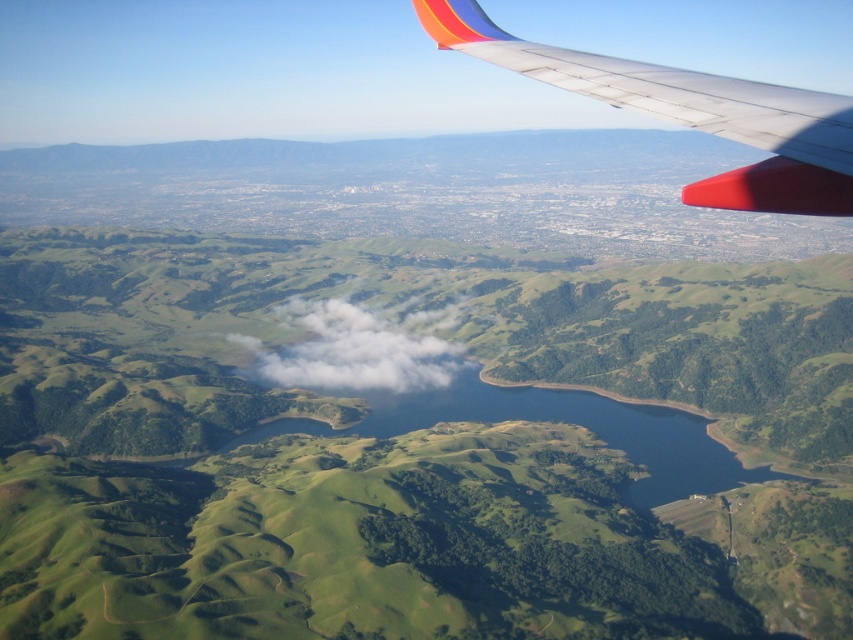
Looking at this image, who is lower down, metallic silver wing at upper right or white fluffy cloud at center?

white fluffy cloud at center is lower down.

Is metallic silver wing at upper right taller than white fluffy cloud at center?

In fact, metallic silver wing at upper right may be shorter than white fluffy cloud at center.

Is point (457, 28) farther from camera compared to point (410, 337)?

No, (457, 28) is closer to viewer.

Locate an element on the screen. metallic silver wing at upper right is located at coordinates (688, 113).

Does green grassy hills at center appear under metallic silver wing at upper right?

Yes, green grassy hills at center is below metallic silver wing at upper right.

Who is higher up, green grassy hills at center or metallic silver wing at upper right?

metallic silver wing at upper right is higher up.

The width and height of the screenshot is (853, 640). What are the coordinates of `green grassy hills at center` in the screenshot? It's located at (x=416, y=444).

Is green grassy hills at center above white fluffy cloud at center?

Incorrect, green grassy hills at center is not positioned above white fluffy cloud at center.

Can you confirm if green grassy hills at center is smaller than white fluffy cloud at center?

Actually, green grassy hills at center might be larger than white fluffy cloud at center.

Find the location of `green grassy hills at center`. green grassy hills at center is located at coordinates (416, 444).